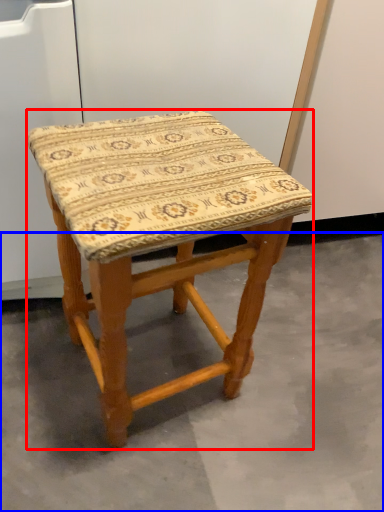
Question: Which of the following is the closest to the observer, stool (highlighted by a red box) or concrete (highlighted by a blue box)?

Choices:
 (A) stool
 (B) concrete

Answer: (A)